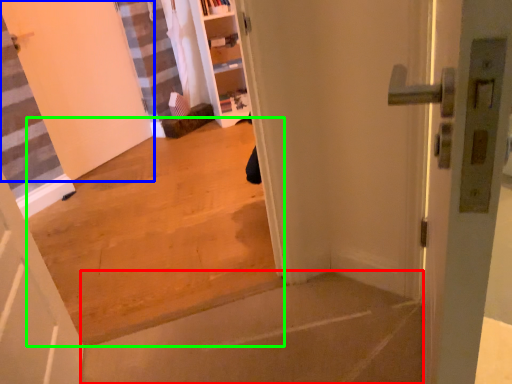
Question: Based on their relative distances, which object is farther from concrete (highlighted by a red box)? Choose from door (highlighted by a blue box) and concrete (highlighted by a green box).

Choices:
 (A) door
 (B) concrete

Answer: (A)